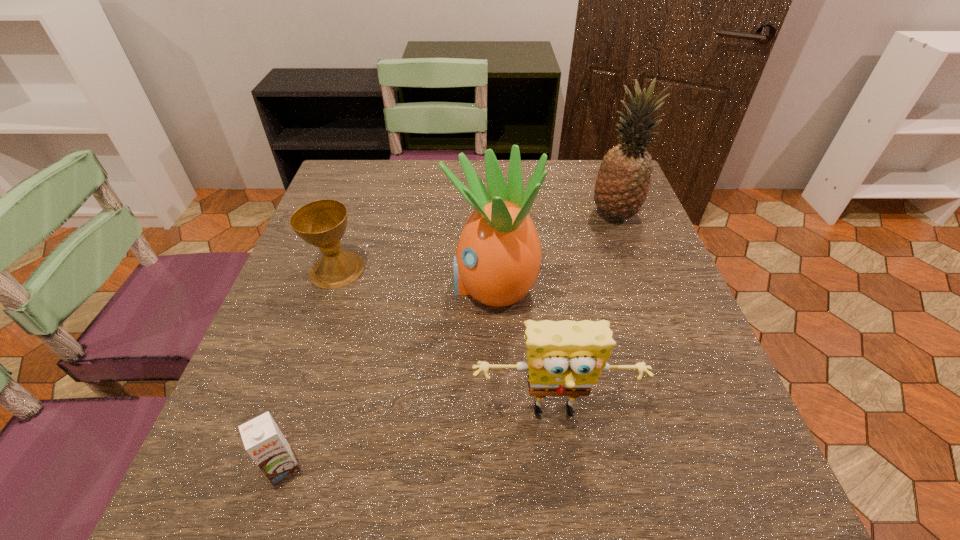
Image resolution: width=960 pixels, height=540 pixels. Identify the location of vacant point located 0.360m at the entrance of the left pineapple. (281, 285).

Locate an element on the screen. The height and width of the screenshot is (540, 960). free space located 0.270m at the entrance of the left pineapple is located at coordinates (324, 285).

Image resolution: width=960 pixels, height=540 pixels. I want to click on vacant region located on the face of the third tallest object, so click(569, 521).

Locate an element on the screen. Image resolution: width=960 pixels, height=540 pixels. vacant area located 0.300m on the front of the chalice is located at coordinates (286, 418).

Locate an element on the screen. The image size is (960, 540). vacant space located on the back of the chocolate milk is located at coordinates (329, 322).

Locate an element on the screen. This screenshot has width=960, height=540. object that is at the far edge is located at coordinates (622, 185).

Locate an element on the screen. The width and height of the screenshot is (960, 540). object that is positioned at the near edge is located at coordinates (263, 440).

Locate an element on the screen. The height and width of the screenshot is (540, 960). chalice that is positioned at the left edge is located at coordinates (322, 223).

Locate an element on the screen. The width and height of the screenshot is (960, 540). chocolate milk present at the left edge is located at coordinates (263, 440).

At what (x,y) coordinates should I click in order to perform the action: click on pineapple that is at the right edge. Please return your answer as a coordinate pair (x, y). Looking at the image, I should click on (622, 185).